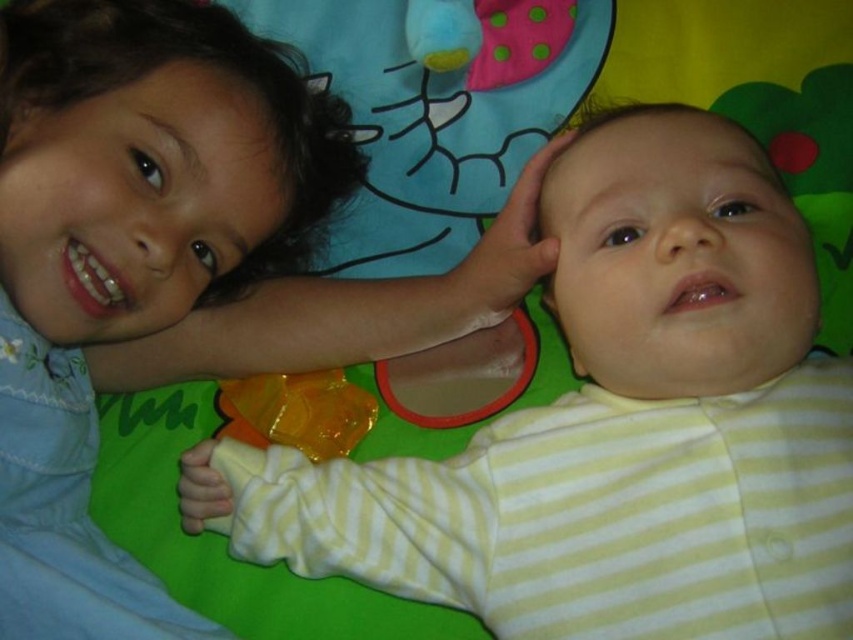
Is matte blue shirt at upper left in front of translucent orange pacifier at lower center?

Yes, it is in front of translucent orange pacifier at lower center.

Locate an element on the screen. matte blue shirt at upper left is located at coordinates (170, 268).

Is point (814, 397) closer to viewer compared to point (252, 433)?

Yes, it is in front of point (252, 433).

Does yellow striped onesie at center appear on the left side of translucent orange pacifier at lower center?

In fact, yellow striped onesie at center is to the right of translucent orange pacifier at lower center.

Measure the distance between yellow striped onesie at center and camera.

A distance of 23.68 inches exists between yellow striped onesie at center and camera.

You are a GUI agent. You are given a task and a screenshot of the screen. Output one action in this format:
    pyautogui.click(x=<x>, y=<y>)
    Task: Click on the yellow striped onesie at center
    The image size is (853, 640).
    Given the screenshot: What is the action you would take?
    pyautogui.click(x=583, y=396)

Can you confirm if matte blue shirt at upper left is positioned below yellow striped onesie at center?

Actually, matte blue shirt at upper left is above yellow striped onesie at center.

Between matte blue shirt at upper left and yellow striped onesie at center, which one appears on the left side from the viewer's perspective?

Positioned to the left is matte blue shirt at upper left.

Does point (90, 387) come in front of point (705, 388)?

No, (90, 387) is behind (705, 388).

This screenshot has height=640, width=853. I want to click on matte blue shirt at upper left, so click(170, 268).